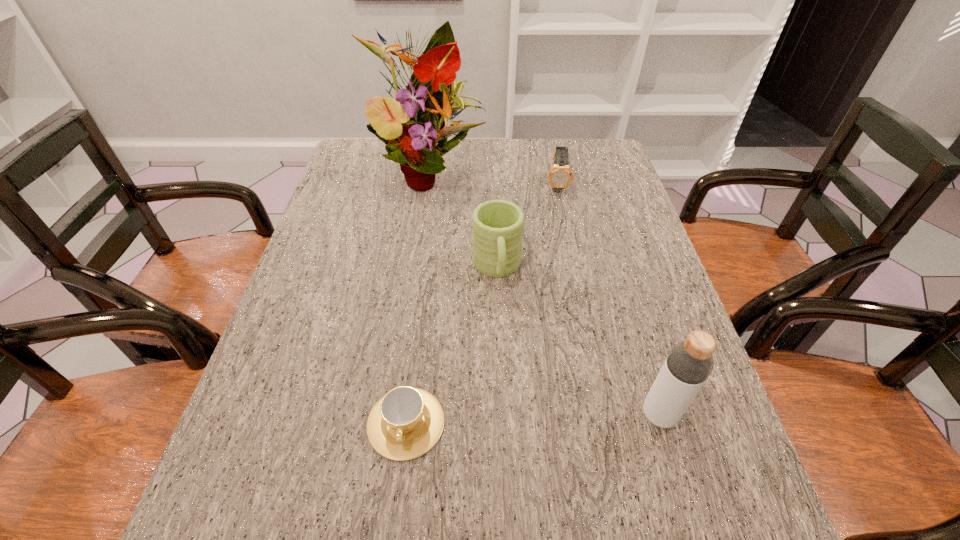
This screenshot has width=960, height=540. Identify the location of cup located at the near edge. (407, 422).

At what (x,y) coordinates should I click in order to perform the action: click on bottle that is positioned at the near edge. Please return your answer as a coordinate pair (x, y). Looking at the image, I should click on (689, 363).

At what (x,y) coordinates should I click in order to perform the action: click on object at the left edge. Please return your answer as a coordinate pair (x, y). Looking at the image, I should click on 420,116.

I want to click on object present at the right edge, so click(689, 363).

Locate an element on the screen. object that is at the far left corner is located at coordinates (420, 116).

This screenshot has width=960, height=540. Identify the location of object at the near right corner. (689, 363).

Where is `vacant space at the far edge`? vacant space at the far edge is located at coordinates (552, 156).

Image resolution: width=960 pixels, height=540 pixels. In the image, there is a desktop. What are the coordinates of `free space at the near edge` in the screenshot? It's located at (600, 457).

Image resolution: width=960 pixels, height=540 pixels. In the image, there is a desktop. What are the coordinates of `vacant space at the left edge` in the screenshot? It's located at (372, 184).

The width and height of the screenshot is (960, 540). I want to click on vacant space at the right edge of the desktop, so click(x=621, y=241).